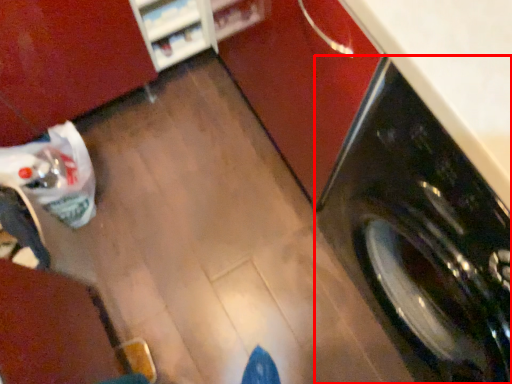
Question: Considering the relative positions of washing machine (annotated by the red box) and shelf in the image provided, where is washing machine (annotated by the red box) located with respect to the staircase?

Choices:
 (A) right
 (B) left

Answer: (A)